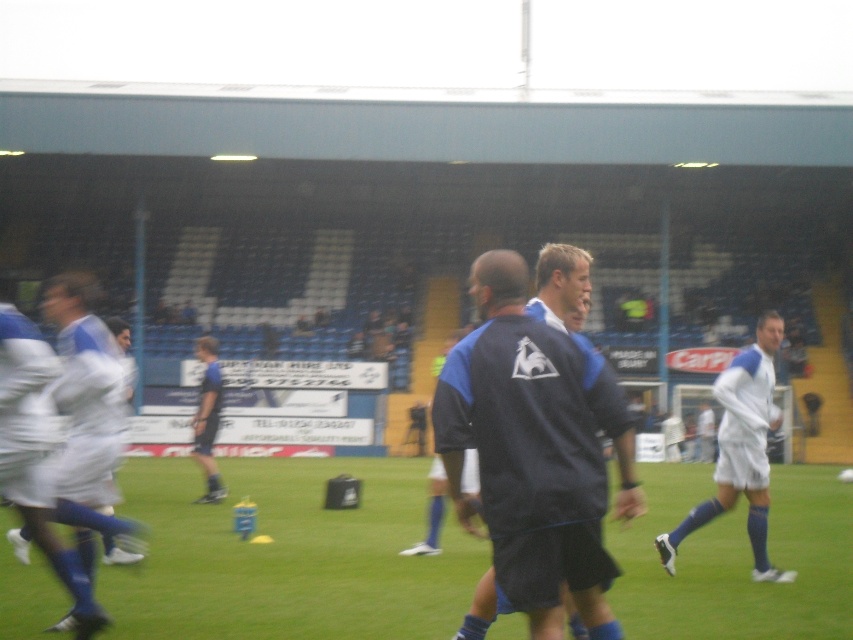
Is point (204, 570) behind point (62, 310)?

Yes.

Between point (335, 636) and point (56, 392), which one is positioned behind?

The point (335, 636) is more distant.

Locate an element on the screen. This screenshot has height=640, width=853. green grass at center is located at coordinates (287, 556).

Can you confirm if blue jersey at center is bigger than white fabric shorts at left?

Incorrect, blue jersey at center is not larger than white fabric shorts at left.

Is point (233, 541) more distant than point (76, 454)?

Yes, it is behind point (76, 454).

The height and width of the screenshot is (640, 853). What do you see at coordinates (286, 556) in the screenshot? I see `blue jersey at center` at bounding box center [286, 556].

Find the location of a particular element. This screenshot has height=640, width=853. blue jersey at center is located at coordinates (286, 556).

Is point (749, 435) in front of point (193, 452)?

Yes.

Is point (781, 339) more distant than point (204, 438)?

Yes, point (781, 339) is behind point (204, 438).

Identify the location of white smooth soccer player at right. The width and height of the screenshot is (853, 640). (741, 449).